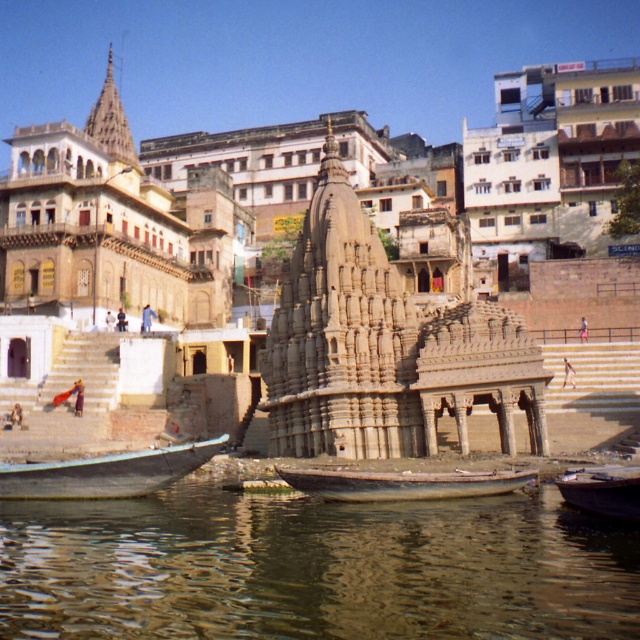
Question: Which is nearer to the beige stone temple at center?

Choices:
 (A) blue wooden boat at lower left
 (B) wooden boat at center
 (C) wooden boat at lower right

Answer: (A)

Question: Which point is farther from the camera taking this photo?

Choices:
 (A) (625, 502)
 (B) (502, 474)
 (C) (620, 65)
 (D) (19, 493)

Answer: (C)

Question: Can you confirm if greenish water at lower center is positioned below wooden boat at lower right?

Choices:
 (A) yes
 (B) no

Answer: (A)

Question: Among these objects, which one is nearest to the camera?

Choices:
 (A) greenish water at lower center
 (B) wooden boat at lower right

Answer: (A)

Question: Can you confirm if beige stone temple at center is positioned to the right of blue wooden boat at lower left?

Choices:
 (A) yes
 (B) no

Answer: (A)

Question: Is beige stone temple at center closer to the viewer compared to wooden boat at center?

Choices:
 (A) no
 (B) yes

Answer: (A)